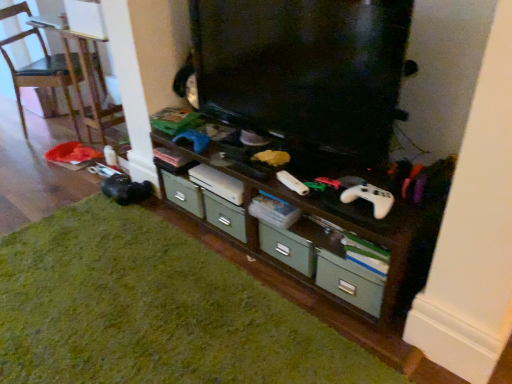
Question: From a real-world perspective, does white matte game controller at center sit lower than wooden chair at left?

Choices:
 (A) no
 (B) yes

Answer: (A)

Question: Is white matte game controller at center oriented towards wooden chair at left?

Choices:
 (A) yes
 (B) no

Answer: (B)

Question: Is there a large distance between white matte game controller at center and wooden chair at left?

Choices:
 (A) no
 (B) yes

Answer: (B)

Question: Considering the relative positions of white matte game controller at center and wooden chair at left in the image provided, is white matte game controller at center to the right of wooden chair at left from the viewer's perspective?

Choices:
 (A) yes
 (B) no

Answer: (A)

Question: Is wooden chair at left surrounded by white matte game controller at center?

Choices:
 (A) no
 (B) yes

Answer: (A)

Question: From a real-world perspective, is white matte game controller at center on top of wooden chair at left?

Choices:
 (A) no
 (B) yes

Answer: (B)

Question: Is wooden shelf at center at the left side of wooden chair at left?

Choices:
 (A) yes
 (B) no

Answer: (B)

Question: Does wooden shelf at center have a larger size compared to wooden chair at left?

Choices:
 (A) yes
 (B) no

Answer: (B)

Question: Is wooden shelf at center taller than wooden chair at left?

Choices:
 (A) no
 (B) yes

Answer: (A)

Question: Are wooden shelf at center and wooden chair at left located far from each other?

Choices:
 (A) yes
 (B) no

Answer: (A)

Question: Is wooden chair at left at the back of wooden shelf at center?

Choices:
 (A) no
 (B) yes

Answer: (A)

Question: Does wooden shelf at center come behind wooden chair at left?

Choices:
 (A) yes
 (B) no

Answer: (B)

Question: Are wooden chair at left and green matte drawer at lower center beside each other?

Choices:
 (A) no
 (B) yes

Answer: (A)